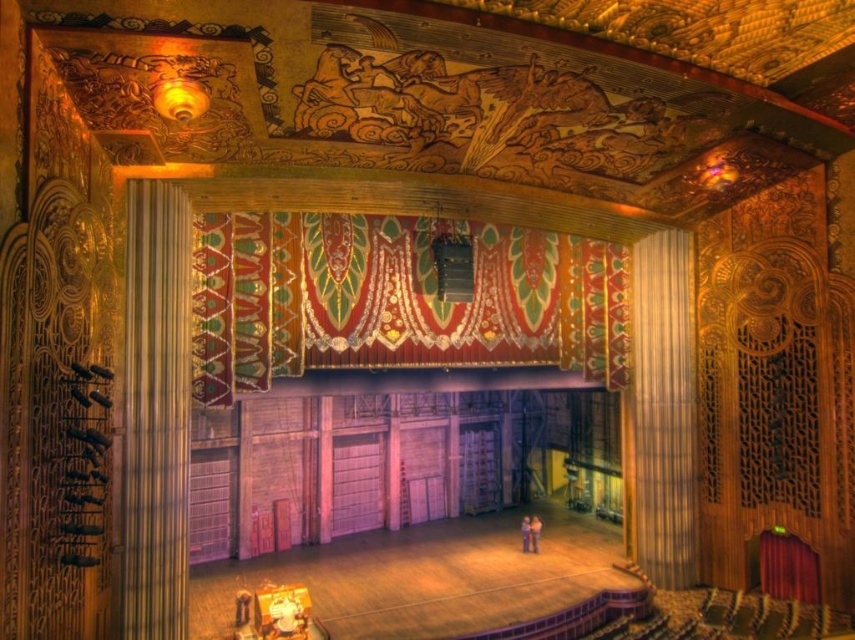
Question: Is velvet tapestry at center bigger than gold textured curtain at left?

Choices:
 (A) no
 (B) yes

Answer: (A)

Question: Can you confirm if gold textured curtain at left is positioned to the right of gold textured curtain at right?

Choices:
 (A) yes
 (B) no

Answer: (B)

Question: Which point appears farthest from the camera in this image?

Choices:
 (A) (364, 292)
 (B) (690, 364)
 (C) (154, 528)

Answer: (B)

Question: Based on their relative distances, which object is farther from the gold textured curtain at left?

Choices:
 (A) gold textured curtain at right
 (B) velvet tapestry at center

Answer: (A)

Question: Does velvet tapestry at center appear on the right side of gold textured curtain at left?

Choices:
 (A) yes
 (B) no

Answer: (A)

Question: Which object appears closest to the camera in this image?

Choices:
 (A) velvet tapestry at center
 (B) gold textured curtain at right
 (C) gold textured curtain at left

Answer: (C)